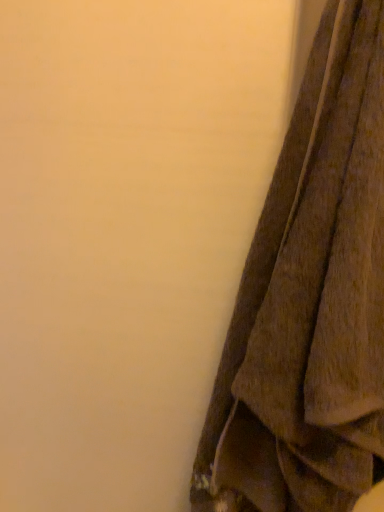
You are a GUI agent. You are given a task and a screenshot of the screen. Output one action in this format:
    pyautogui.click(x=<x>, y=<y>)
    Task: Click on the brown textured towel at right
    This screenshot has height=512, width=384.
    Given the screenshot: What is the action you would take?
    pyautogui.click(x=310, y=300)

This screenshot has height=512, width=384. What do you see at coordinates (310, 300) in the screenshot?
I see `brown textured towel at right` at bounding box center [310, 300].

What is the approximate height of brown textured towel at right?

The height of brown textured towel at right is 34.86 inches.

Locate an element on the screen. The width and height of the screenshot is (384, 512). brown textured towel at right is located at coordinates (310, 300).